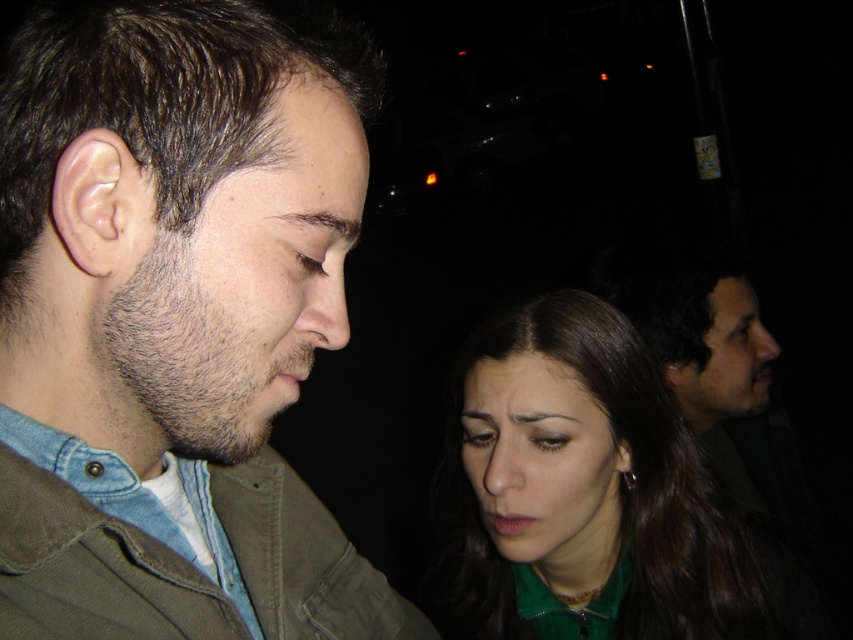
You are a photographer setting up a shot in a dimly lit room. You have a green matte shirt at lower right and a dark brown hair at right in your frame. Which object occupies more horizontal space in the image?

The green matte shirt at lower right occupies more horizontal space than the dark brown hair at right because its width surpasses the latter.

You are a photographer trying to capture a candid shot of the dark brown hair at right and the green matte shirt at lower right. Which object is positioned lower in the frame?

The green matte shirt at lower right is positioned below the dark brown hair at right, so the green matte shirt at lower right is lower in the frame.

You are a photographer trying to capture a portrait of both dark brown hair at right and dark brown hair at upper center. Which one should you focus on first to ensure their hair is properly framed in the shot?

The dark brown hair at right has a greater height compared to dark brown hair at upper center, so you should focus on the dark brown hair at right first to ensure proper framing.